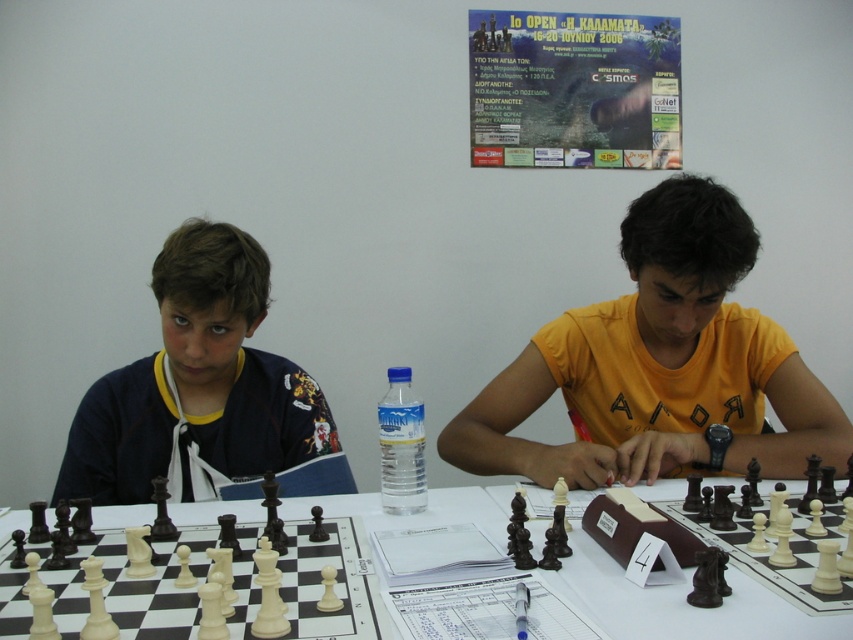
Question: Is the position of orange cotton shirt at center less distant than that of white plastic table at center?

Choices:
 (A) yes
 (B) no

Answer: (B)

Question: Among these points, which one is nearest to the camera?

Choices:
 (A) (178, 424)
 (B) (334, 512)
 (C) (740, 236)
 (D) (468, 20)

Answer: (C)

Question: Is orange cotton shirt at center wider than dark blue fabric shirt at left?

Choices:
 (A) no
 (B) yes

Answer: (B)

Question: Which point appears farthest from the camera in this image?

Choices:
 (A) (125, 392)
 (B) (308, 497)
 (C) (596, 90)
 (D) (589, 353)

Answer: (C)

Question: Is paper poster at upper center below white plastic table at center?

Choices:
 (A) no
 (B) yes

Answer: (A)

Question: Estimate the real-world distances between objects in this image. Which object is farther from the paper poster at upper center?

Choices:
 (A) white plastic table at center
 (B) dark blue fabric shirt at left

Answer: (A)